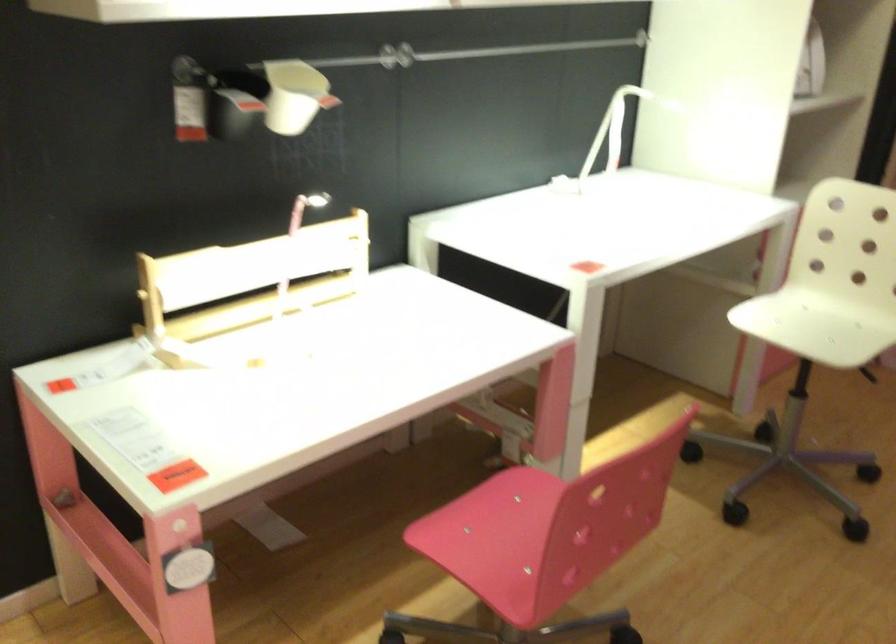
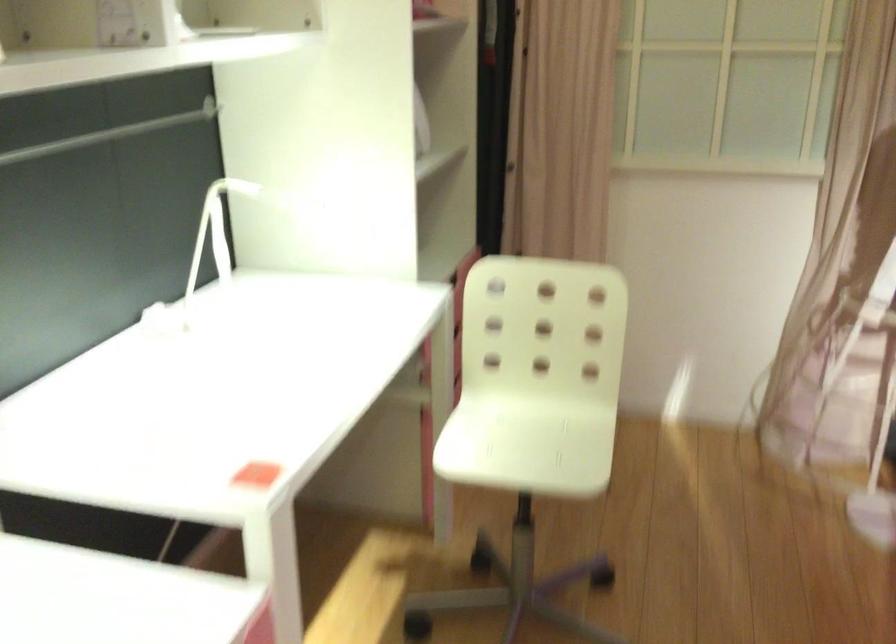
In the second image, find the point that corresponds to (790,317) in the first image.

(495, 431)